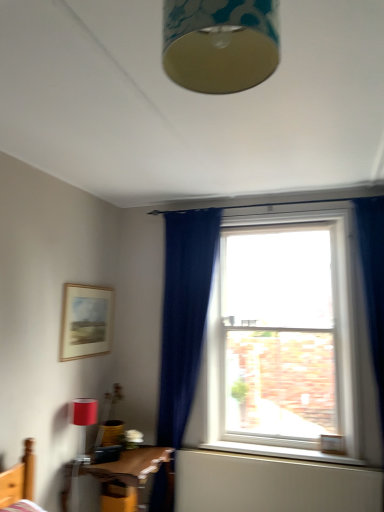
Find the location of a particular element. This screenshot has height=512, width=384. vacant region above white wooden window sill at lower center (from a real-world perspective) is located at coordinates (282, 451).